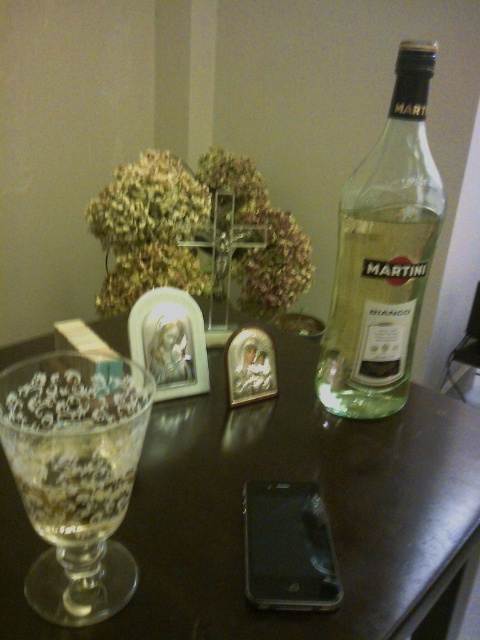
Question: Which object appears closest to the camera in this image?

Choices:
 (A) transparent textured glass at left
 (B) transparent glass at center
 (C) clear glass bottle at right

Answer: (A)

Question: Among these points, which one is nearest to the camera?

Choices:
 (A) (377, 349)
 (B) (142, 381)
 (C) (384, 419)

Answer: (B)

Question: Which point is closer to the camera?

Choices:
 (A) transparent textured glass at left
 (B) clear glass bottle at right
 (C) transparent plastic smartphone at center

Answer: (A)

Question: Can you confirm if transparent glass at center is bigger than transparent plastic smartphone at center?

Choices:
 (A) yes
 (B) no

Answer: (A)

Question: From the image, what is the correct spatial relationship of transparent textured glass at left in relation to transparent plastic smartphone at center?

Choices:
 (A) right
 (B) left

Answer: (B)

Question: Where is transparent textured glass at left located in relation to clear glass bottle at right in the image?

Choices:
 (A) right
 (B) left

Answer: (B)